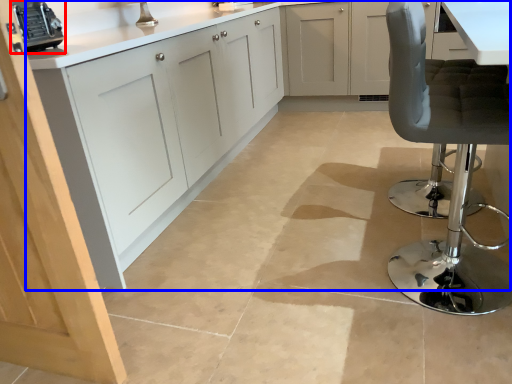
Question: Which of the following is the farthest to the observer, appliance (highlighted by a red box) or cabinetry (highlighted by a blue box)?

Choices:
 (A) appliance
 (B) cabinetry

Answer: (A)